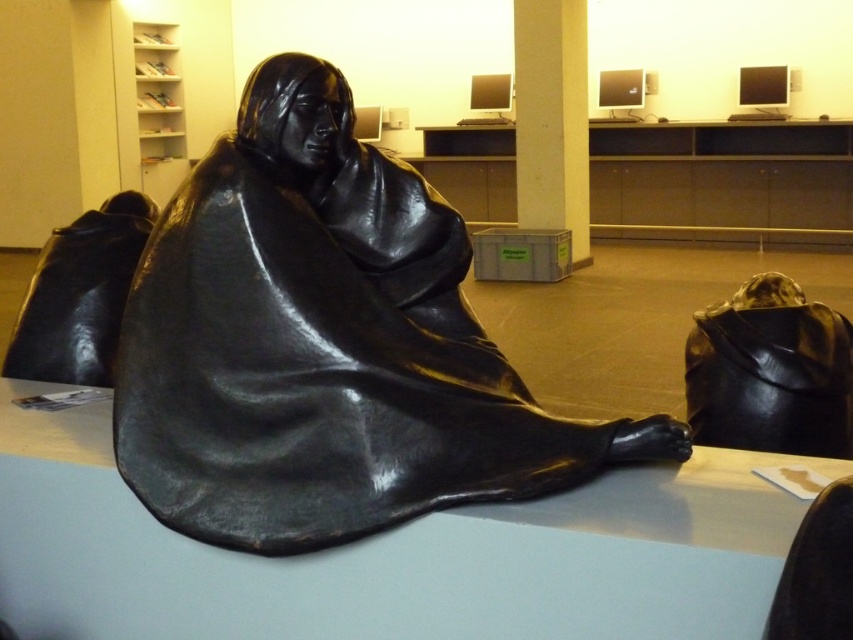
You are an interior designer planning to place a 2.5 meter tall plant next to the shiny black statue at center and the glossy black table at center. Based on their heights, which object will the plant tower over more?

The shiny black statue at center has a greater height compared to the glossy black table at center. Since the plant is 2.5 meters tall, it will tower over both objects, but it will tower over the glossy black table at center more because the statue is taller than the table.

You are an art curator examining the sculpture in the image. The sculpture is positioned at the center of the room. You notice a point marked at coordinates (325,346). Can you determine what object this point corresponds to?

The point at coordinates (325,346) corresponds to the shiny black statue at center.